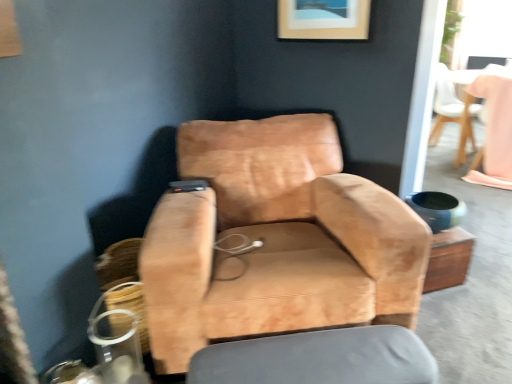
Find the location of a particular element. This screenshot has width=512, height=384. vacant space situated above smooth gray cushion at lower center (from a real-world perspective) is located at coordinates (309, 359).